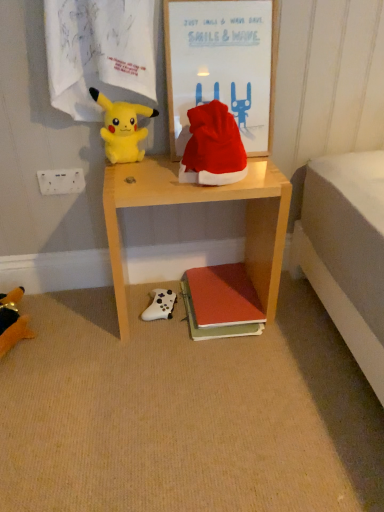
Find the location of a particular element. free spot above wooden desk at center (from a real-world perspective) is located at coordinates (194, 177).